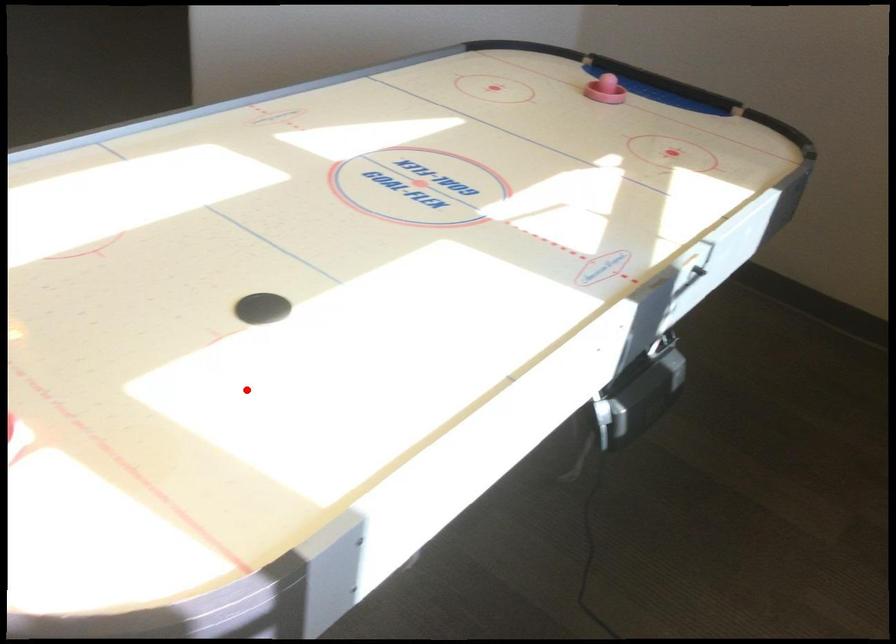
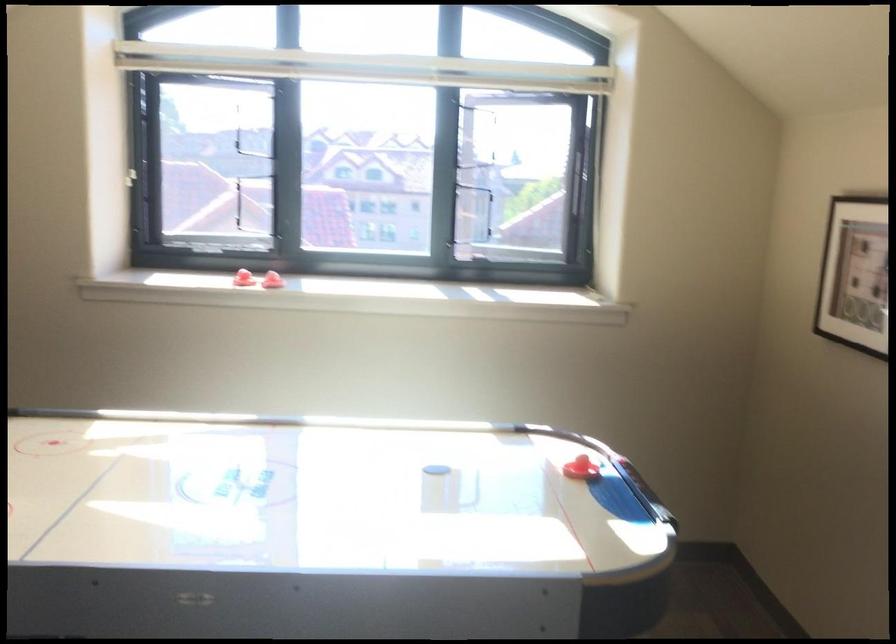
Where in the second image is the point corresponding to the highlighted location from the first image?

(442, 467)